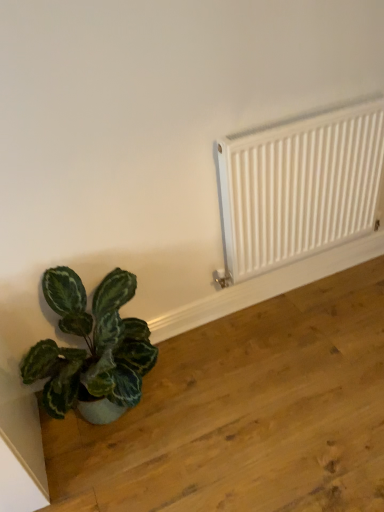
Identify the location of vacant space in white matte radiator at upper right (from a real-world perspective). The height and width of the screenshot is (512, 384). 296,283.